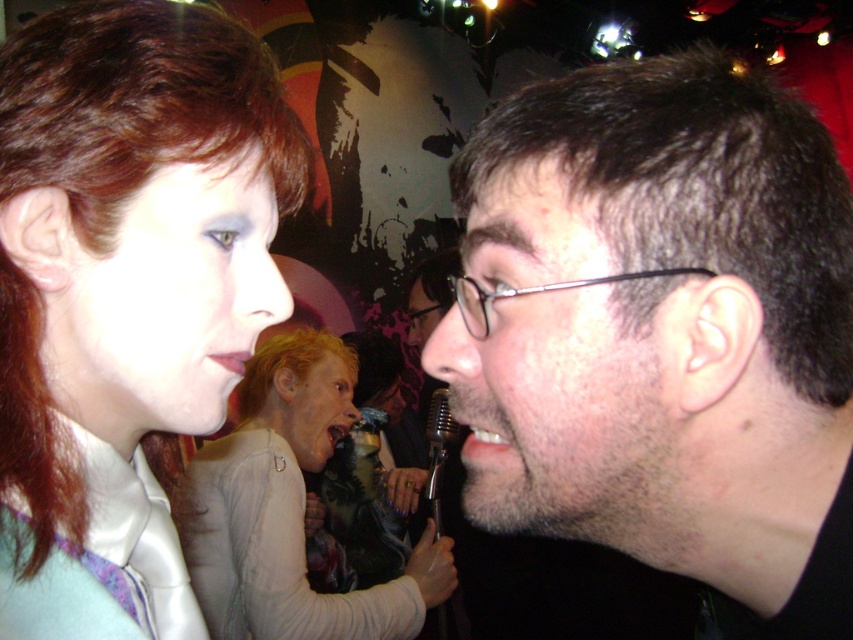
In the image, you see two people at a social gathering. The person on the left has reddish hair and is wearing a light top, while the person on the right has dark brown hair and a beard. You need to determine the spatial relationship between the dark brown hair at center and the light beige sweater at center. Which object is located above the other?

The dark brown hair at center is positioned over light beige sweater at center, meaning the dark brown hair is above the light beige sweater.

Consider the image. In the scene, there are two people. The person on the left is wearing a light colored top, and the person on the right is wearing glasses. Where is the satin white shirt at upper left located in terms of coordinates?

The satin white shirt at upper left is located at coordinates point [120,276].